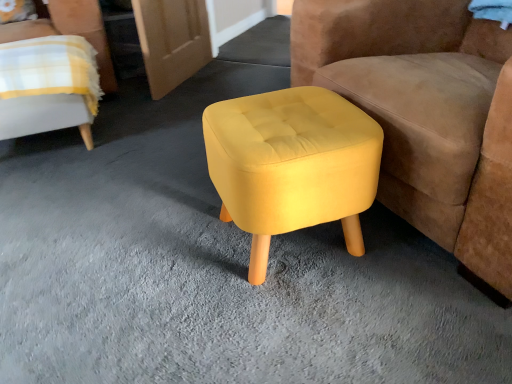
Image resolution: width=512 pixels, height=384 pixels. I want to click on blank space situated above yellow fabric ottoman at center (from a real-world perspective), so click(x=262, y=41).